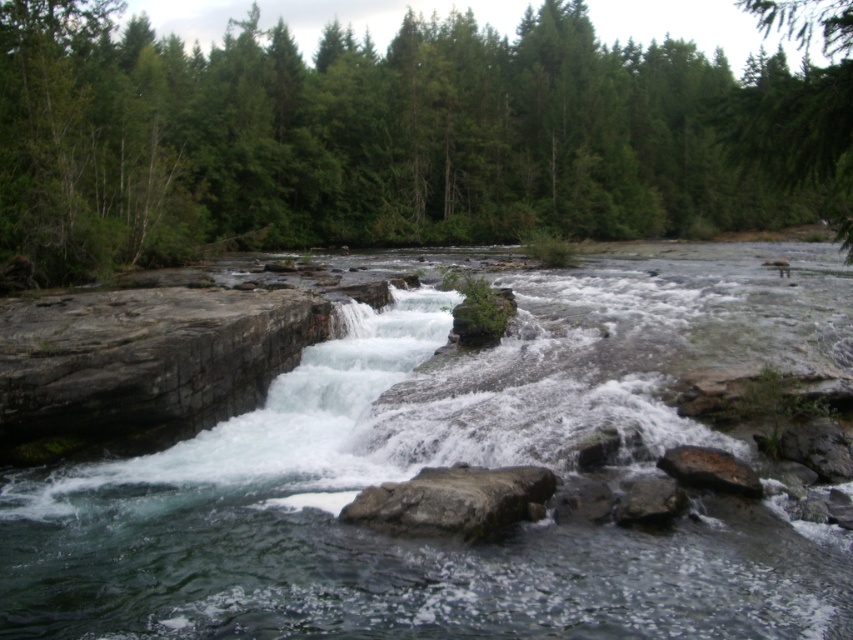
Which of these two, green textured tree at upper right or smooth gray rock at lower center, stands taller?

With more height is green textured tree at upper right.

Measure the distance between green textured tree at upper right and camera.

green textured tree at upper right and camera are 6.54 meters apart.

Who is more forward, [805,157] or [639,477]?

Positioned in front is point [805,157].

I want to click on green textured tree at upper right, so click(798, 108).

Does green textured tree at upper right appear under gray rough rock at center?

Actually, green textured tree at upper right is above gray rough rock at center.

Measure the distance between point (762, 136) and camera.

Point (762, 136) is 6.83 meters from camera.

Does point (788, 35) come closer to viewer compared to point (521, 490)?

No, it is behind (521, 490).

The image size is (853, 640). Identify the location of green textured tree at upper right. (798, 108).

Between point (805, 115) and point (706, 474), which one is positioned in front?

Point (805, 115)

Does point (784, 134) lie in front of point (735, 490)?

Yes, it is.

Where is `green textured tree at upper right`? This screenshot has height=640, width=853. green textured tree at upper right is located at coordinates (798, 108).